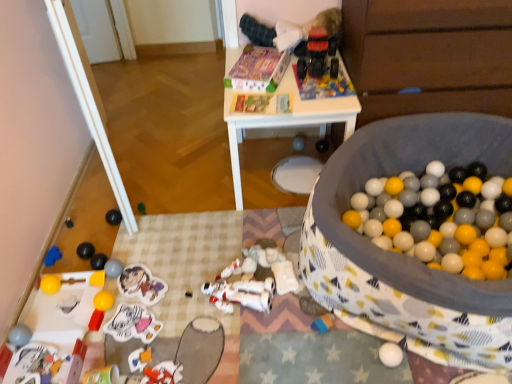
Find the location of a particular element. The height and width of the screenshot is (384, 512). vacant area that is in front of matte gray ball at lower left, which appears as the 12th toy when viewed from the right is located at coordinates (115, 311).